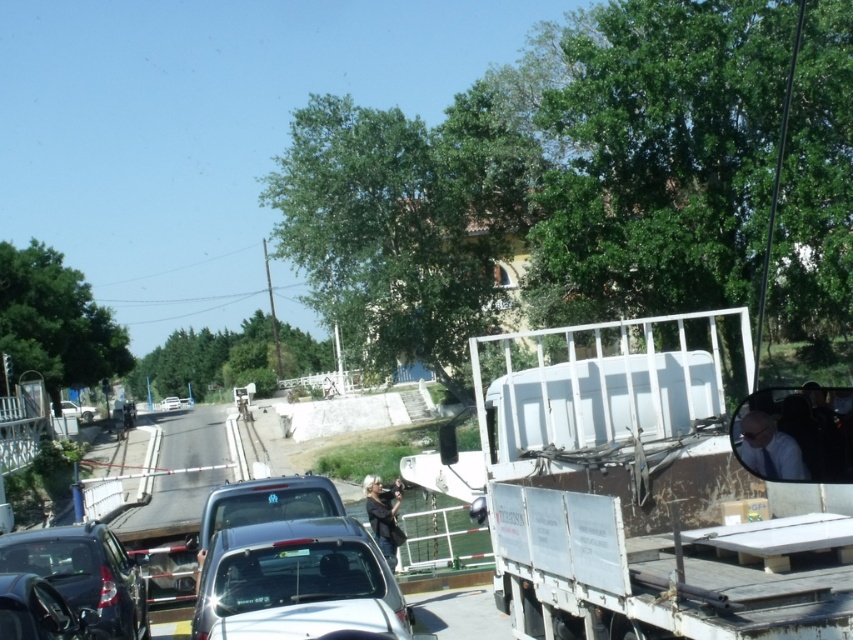
Does shiny black sedan at center appear on the right side of dark gray fabric jacket at center?

Indeed, shiny black sedan at center is positioned on the right side of dark gray fabric jacket at center.

This screenshot has height=640, width=853. I want to click on shiny black sedan at center, so click(x=296, y=582).

Which is behind, point (292, 605) or point (389, 531)?

The point (389, 531) is behind.

I want to click on shiny black sedan at center, so click(296, 582).

Based on the photo, between shiny black sedan at center and metallic silver car at center, which one has more height?

With more height is metallic silver car at center.

Is shiny black sedan at center thinner than metallic silver car at center?

Indeed, shiny black sedan at center has a lesser width compared to metallic silver car at center.

Image resolution: width=853 pixels, height=640 pixels. Describe the element at coordinates (296, 582) in the screenshot. I see `shiny black sedan at center` at that location.

Find the location of a particular element. This screenshot has height=640, width=853. shiny black sedan at center is located at coordinates (296, 582).

Can you confirm if white matte trailer truck at right is smaller than dark gray fabric jacket at center?

Incorrect, white matte trailer truck at right is not smaller in size than dark gray fabric jacket at center.

The width and height of the screenshot is (853, 640). In order to click on white matte trailer truck at right in this screenshot , I will do `click(653, 488)`.

What are the coordinates of `white matte trailer truck at right` in the screenshot? It's located at (653, 488).